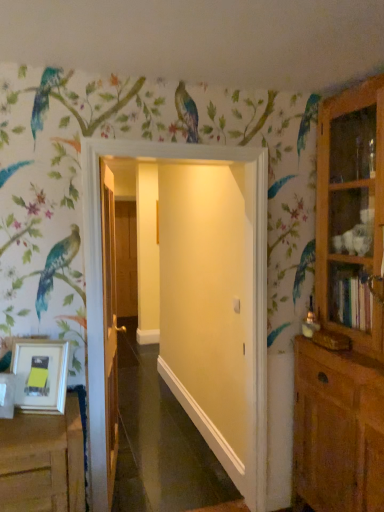
Measure the distance between point (x=326, y=266) and camera.

Point (x=326, y=266) and camera are 7.67 feet apart from each other.

Find the location of `wooden door at center, acting as the second door starting from the back`. wooden door at center, acting as the second door starting from the back is located at coordinates (109, 322).

Describe the element at coordinates (40, 374) in the screenshot. I see `white matte picture frame at lower left` at that location.

Where is `white matte picture frame at lower left`? white matte picture frame at lower left is located at coordinates (40, 374).

How much space does brown wooden door at center, arranged as the 1th door when viewed from the back, occupy horizontally?

5.97 inches.

I want to click on brown wooden door at center, acting as the 3th door starting from the front, so click(126, 258).

Where is `wooden cabinet at right`? wooden cabinet at right is located at coordinates (345, 315).

Which object is further away from the camera taking this photo, white matte picture frame at lower left or wooden door at center, which is the 2th door in right-to-left order?

wooden door at center, which is the 2th door in right-to-left order, is further from the camera.

Considering the points (27, 369) and (102, 230), which point is in front, point (27, 369) or point (102, 230)?

Positioned in front is point (27, 369).

Do you think white matte picture frame at lower left is within wooden door at center, which is the 2th door in right-to-left order, or outside of it?

white matte picture frame at lower left is located beyond the bounds of wooden door at center, which is the 2th door in right-to-left order.

Considering the sizes of white matte picture frame at lower left and wooden door at center, marked as the 2th door in a front-to-back arrangement, in the image, is white matte picture frame at lower left bigger or smaller than wooden door at center, marked as the 2th door in a front-to-back arrangement,?

In the image, white matte picture frame at lower left appears to be smaller than wooden door at center, marked as the 2th door in a front-to-back arrangement.

Is white matte picture frame at lower left facing towards wooden cabinet at right?

No, white matte picture frame at lower left is not turned towards wooden cabinet at right.

Would you say white matte picture frame at lower left is a long distance from wooden cabinet at right?

Absolutely, white matte picture frame at lower left is distant from wooden cabinet at right.

Can you confirm if white matte picture frame at lower left is thinner than wooden cabinet at right?

Correct, the width of white matte picture frame at lower left is less than that of wooden cabinet at right.

Is point (45, 412) positioned in front of point (377, 155)?

That is True.

How different are the orientations of brown wooden door at center, which appears as the 1th door when viewed from the left, and white matte door at center, which ranks as the 3th door in back-to-front order, in degrees?

brown wooden door at center, which appears as the 1th door when viewed from the left, and white matte door at center, which ranks as the 3th door in back-to-front order, are facing 0.125 degrees away from each other.

Is brown wooden door at center, acting as the 3th door starting from the front, bigger than white matte door at center, the first door from the front?

Actually, brown wooden door at center, acting as the 3th door starting from the front, might be smaller than white matte door at center, the first door from the front.

Considering the positions of objects brown wooden door at center, which appears as the 1th door when viewed from the left, and white matte door at center, which ranks as the 3th door in back-to-front order, in the image provided, who is more to the right, brown wooden door at center, which appears as the 1th door when viewed from the left, or white matte door at center, which ranks as the 3th door in back-to-front order,?

Positioned to the right is white matte door at center, which ranks as the 3th door in back-to-front order.

Does brown wooden door at center, arranged as the 1th door when viewed from the back, touch white matte door at center, the 3th door in the left-to-right sequence?

No, brown wooden door at center, arranged as the 1th door when viewed from the back, is not making contact with white matte door at center, the 3th door in the left-to-right sequence.

Could you tell me if wooden cabinet at right is turned towards white matte door at center, which ranks as the 3th door in back-to-front order?

No, wooden cabinet at right is not turned towards white matte door at center, which ranks as the 3th door in back-to-front order.

Is white matte door at center, the first door positioned from the right, surrounded by wooden cabinet at right?

No, white matte door at center, the first door positioned from the right, is not surrounded by wooden cabinet at right.

Considering their positions, is wooden cabinet at right located in front of or behind white matte door at center, the 3th door in the left-to-right sequence?

In the image, wooden cabinet at right appears in front of white matte door at center, the 3th door in the left-to-right sequence.

Is wooden cabinet at right at the left side of white matte door at center, the 3th door in the left-to-right sequence?

Incorrect, wooden cabinet at right is not on the left side of white matte door at center, the 3th door in the left-to-right sequence.

Is point (89, 209) positioned in front of point (131, 278)?

Yes, point (89, 209) is in front of point (131, 278).

Does white matte door at center, the first door positioned from the right, have a larger size compared to brown wooden door at center, acting as the 3th door starting from the front?

Indeed, white matte door at center, the first door positioned from the right, has a larger size compared to brown wooden door at center, acting as the 3th door starting from the front.

Between white matte door at center, the 3th door in the left-to-right sequence, and brown wooden door at center, the third door viewed from the right, which one has less height?

brown wooden door at center, the third door viewed from the right.

Is the surface of wooden cabinet at right in direct contact with wooden door at center, which is counted as the second door, starting from the left?

No.

Based on the photo, is wooden cabinet at right inside the boundaries of wooden door at center, which is counted as the second door, starting from the left, or outside?

wooden cabinet at right cannot be found inside wooden door at center, which is counted as the second door, starting from the left.

Consider the image. From a real-world perspective, is wooden cabinet at right under wooden door at center, acting as the second door starting from the back?

No.

Does wooden cabinet at right have a greater width compared to white matte picture frame at lower left?

Indeed, wooden cabinet at right has a greater width compared to white matte picture frame at lower left.

From a real-world perspective, who is located higher, wooden cabinet at right or white matte picture frame at lower left?

wooden cabinet at right.

Who is more distant, wooden cabinet at right or white matte picture frame at lower left?

white matte picture frame at lower left.

Is wooden cabinet at right far from white matte picture frame at lower left?

Yes, wooden cabinet at right and white matte picture frame at lower left are quite far apart.

Locate an element on the screen. The height and width of the screenshot is (512, 384). the 1st door to the right of the white matte picture frame at lower left, starting your count from the anchor is located at coordinates (109, 322).

Identify the location of picture frame below the wooden cabinet at right (from the image's perspective). (40, 374).

Based on their spatial positions, is wooden cabinet at right or white matte door at center, which ranks as the 3th door in back-to-front order, further from wooden door at center, acting as the second door starting from the back?

wooden cabinet at right.

Based on their spatial positions, is brown wooden door at center, which appears as the 1th door when viewed from the left, or white matte door at center, the first door positioned from the right, further from white matte picture frame at lower left?

Based on the image, brown wooden door at center, which appears as the 1th door when viewed from the left, appears to be further to white matte picture frame at lower left.

From the image, which object appears to be farther from brown wooden door at center, acting as the 3th door starting from the front, wooden door at center, which is the 2th door in right-to-left order, or white matte door at center, the first door from the front?

Among the two, white matte door at center, the first door from the front, is located further to brown wooden door at center, acting as the 3th door starting from the front.

When comparing their distances from wooden cabinet at right, does white matte door at center, the 3th door in the left-to-right sequence, or brown wooden door at center, the third door viewed from the right, seem further?

brown wooden door at center, the third door viewed from the right.

Considering their positions, is wooden door at center, which is counted as the second door, starting from the left, positioned closer to brown wooden door at center, arranged as the 1th door when viewed from the back, than white matte picture frame at lower left?

Among the two, wooden door at center, which is counted as the second door, starting from the left, is located nearer to brown wooden door at center, arranged as the 1th door when viewed from the back.

From the image, which object appears to be nearer to white matte picture frame at lower left, wooden door at center, marked as the 2th door in a front-to-back arrangement, or white matte door at center, the first door from the front?

The object closer to white matte picture frame at lower left is white matte door at center, the first door from the front.

Looking at the image, which one is located closer to white matte picture frame at lower left, wooden door at center, which is the 2th door in right-to-left order, or wooden cabinet at right?

Based on the image, wooden door at center, which is the 2th door in right-to-left order, appears to be nearer to white matte picture frame at lower left.

Based on their spatial positions, is white matte picture frame at lower left or brown wooden door at center, arranged as the 1th door when viewed from the back, further from white matte door at center, the first door from the front?

Among the two, brown wooden door at center, arranged as the 1th door when viewed from the back, is located further to white matte door at center, the first door from the front.

At what (x,y) coordinates should I click in order to perform the action: click on picture frame between wooden cabinet at right and brown wooden door at center, which appears as the 1th door when viewed from the left, in the front-back direction. Please return your answer as a coordinate pair (x, y). Image resolution: width=384 pixels, height=512 pixels. Looking at the image, I should click on pos(40,374).

Identify the location of door positioned between white matte door at center, the first door positioned from the right, and brown wooden door at center, which appears as the 1th door when viewed from the left, from near to far. This screenshot has height=512, width=384. (109, 322).

Image resolution: width=384 pixels, height=512 pixels. I want to click on door between white matte picture frame at lower left and white matte door at center, which ranks as the 3th door in back-to-front order, from left to right, so click(x=109, y=322).

Where is `door between wooden door at center, acting as the second door starting from the back, and wooden cabinet at right from left to right`? door between wooden door at center, acting as the second door starting from the back, and wooden cabinet at right from left to right is located at coordinates (103, 294).